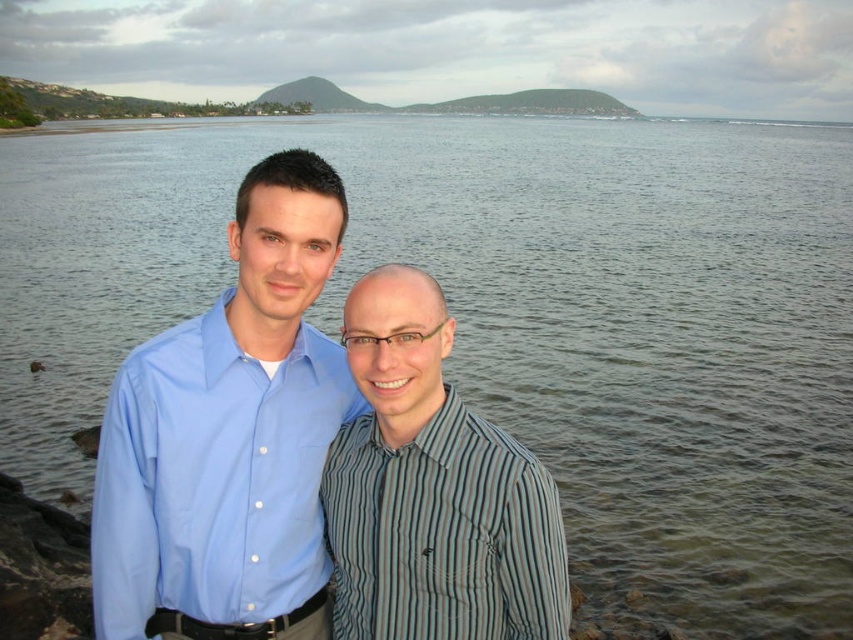
Question: Which point is closer to the camera?

Choices:
 (A) light blue cotton shirt at center
 (B) striped cotton shirt at center
 (C) blue smooth shirt at center

Answer: (B)

Question: Can you confirm if blue smooth shirt at center is bigger than striped cotton shirt at center?

Choices:
 (A) no
 (B) yes

Answer: (B)

Question: Is the position of blue smooth shirt at center more distant than that of striped cotton shirt at center?

Choices:
 (A) yes
 (B) no

Answer: (A)

Question: Can you confirm if blue smooth shirt at center is positioned below striped cotton shirt at center?

Choices:
 (A) no
 (B) yes

Answer: (A)

Question: Which object is closer to the camera taking this photo?

Choices:
 (A) blue smooth shirt at center
 (B) light blue cotton shirt at center
 (C) striped cotton shirt at center

Answer: (C)

Question: Based on their relative distances, which object is farther from the striped cotton shirt at center?

Choices:
 (A) light blue cotton shirt at center
 (B) blue smooth shirt at center

Answer: (B)